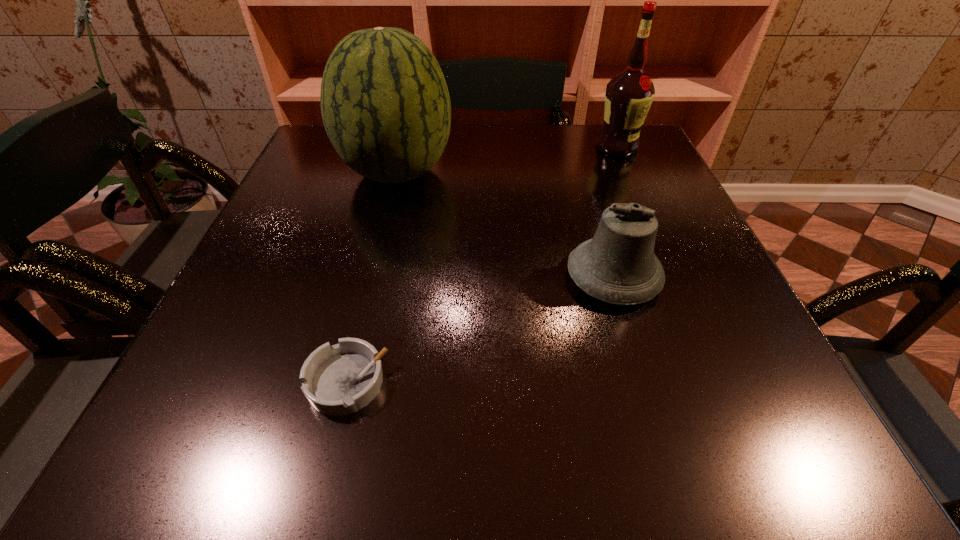
Find the location of a particular element. The image size is (960, 540). alcohol located at the far edge is located at coordinates (629, 95).

This screenshot has width=960, height=540. In order to click on watermelon located at the far edge in this screenshot , I will do `click(385, 105)`.

Find the location of a particular element. object that is positioned at the near edge is located at coordinates coord(341,379).

Find the location of a particular element. The width and height of the screenshot is (960, 540). object located at the left edge is located at coordinates 385,105.

Locate an element on the screen. alcohol that is at the right edge is located at coordinates (629, 95).

Where is `bell that is positioned at the right edge`? Image resolution: width=960 pixels, height=540 pixels. bell that is positioned at the right edge is located at coordinates (618, 265).

This screenshot has width=960, height=540. Identify the location of object that is at the far left corner. (385, 105).

Find the location of a particular element. The height and width of the screenshot is (540, 960). object located at the far right corner is located at coordinates coord(629,95).

Image resolution: width=960 pixels, height=540 pixels. In the image, there is a desktop. Identify the location of vacant space at the far edge. pos(519,165).

The image size is (960, 540). Identify the location of vacant area at the near edge. (506, 409).